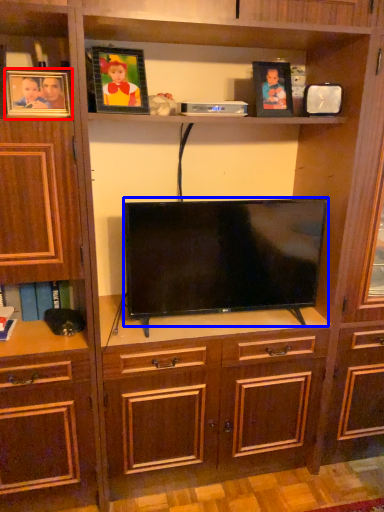
Question: Which object appears closest to the camera in this image, picture frame (highlighted by a red box) or television (highlighted by a blue box)?

Choices:
 (A) picture frame
 (B) television

Answer: (A)